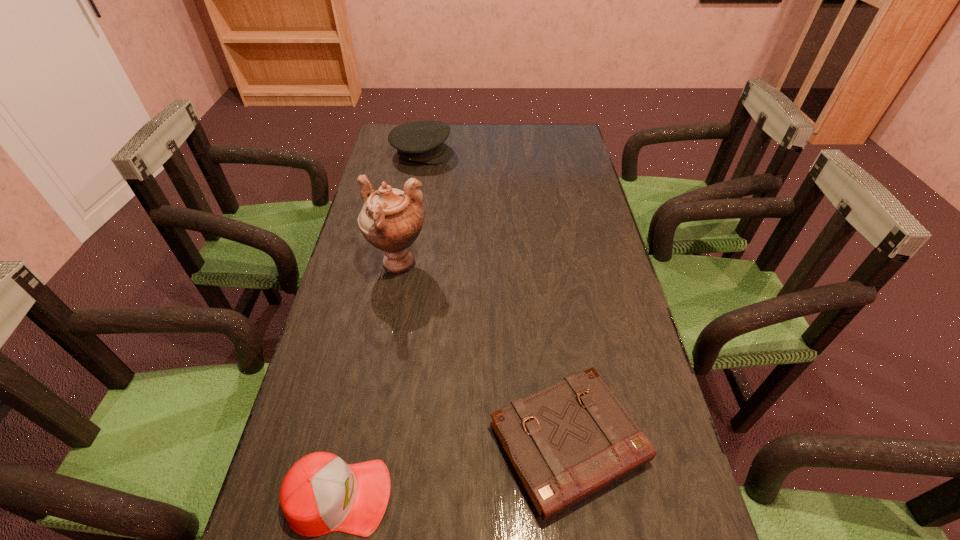
In order to click on free location that satisfies the following two spatial constraints: 1. on the back side of the rightmost object; 2. on the front-facing side of the farthest object in this screenshot , I will do `click(527, 153)`.

What are the coordinates of `blank area in the image that satisfies the following two spatial constraints: 1. on the front side of the third nearest object; 2. on the front-facing side of the third tallest object` in the screenshot? It's located at (355, 496).

The height and width of the screenshot is (540, 960). I want to click on free location that satisfies the following two spatial constraints: 1. on the front-facing side of the shortest object; 2. on the right side of the third shortest object, so click(372, 443).

Locate an element on the screen. free space that satisfies the following two spatial constraints: 1. on the front-facing side of the farthest object; 2. on the back side of the rightmost object is located at coordinates (372, 443).

You are a GUI agent. You are given a task and a screenshot of the screen. Output one action in this format:
    pyautogui.click(x=<x>, y=<y>)
    Task: Click on the vacant space that satisfies the following two spatial constraints: 1. on the front-facing side of the farthest object; 2. on the right side of the shortest object
    This screenshot has width=960, height=540.
    Given the screenshot: What is the action you would take?
    point(372,443)

Find the location of a particular element. vacant space that satisfies the following two spatial constraints: 1. on the front-facing side of the second tallest object; 2. on the left side of the hardback book is located at coordinates (372, 443).

Where is `free spot that satisfies the following two spatial constraints: 1. on the front-facing side of the rightmost object; 2. on the right side of the beret`? The height and width of the screenshot is (540, 960). free spot that satisfies the following two spatial constraints: 1. on the front-facing side of the rightmost object; 2. on the right side of the beret is located at coordinates (372, 443).

The width and height of the screenshot is (960, 540). I want to click on free spot that satisfies the following two spatial constraints: 1. on the front side of the hardback book; 2. on the front-facing side of the third tallest object, so click(575, 496).